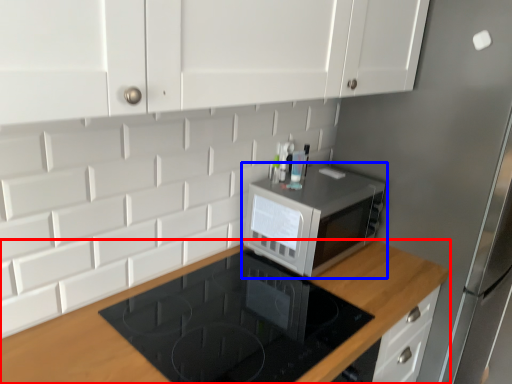
Question: Which of the following is the closest to the observer, countertop (highlighted by a red box) or microwave oven (highlighted by a blue box)?

Choices:
 (A) countertop
 (B) microwave oven

Answer: (A)